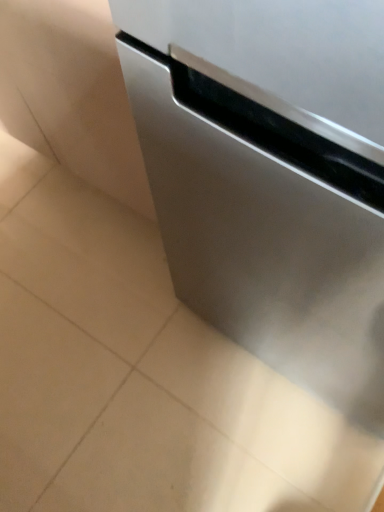
Describe the element at coordinates (270, 177) in the screenshot. I see `stainless steel dishwasher at lower right` at that location.

Where is `stainless steel dishwasher at lower right`? The height and width of the screenshot is (512, 384). stainless steel dishwasher at lower right is located at coordinates (270, 177).

In order to click on stainless steel dishwasher at lower right in this screenshot , I will do `click(270, 177)`.